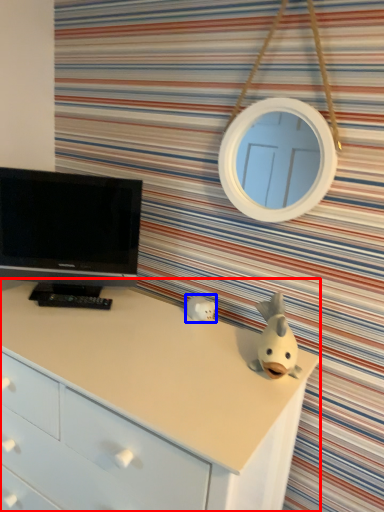
Question: Which object is closer to the camera taking this photo, chest of drawers (highlighted by a red box) or toy (highlighted by a blue box)?

Choices:
 (A) chest of drawers
 (B) toy

Answer: (A)